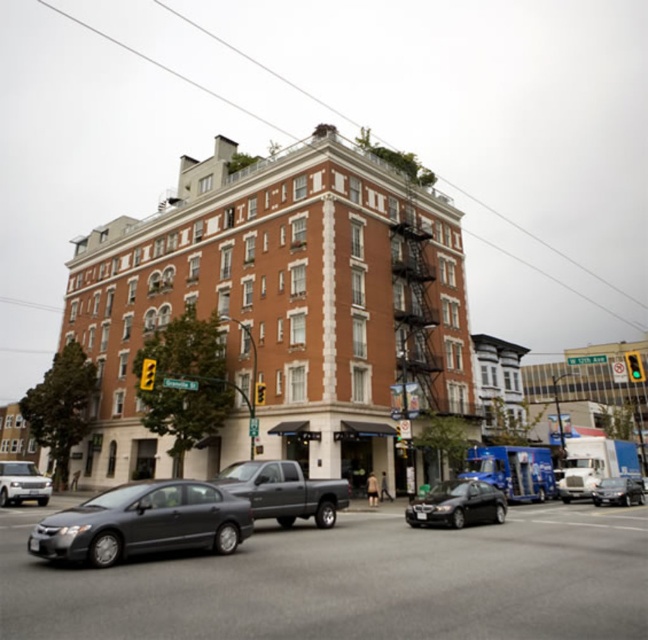
You are driving a metallic gray car at center and want to pass the shiny silver sedan at center ahead of you. Given that your car is 15 feet long, is there enough space to safely make this maneuver?

The distance between the metallic gray car at center and the shiny silver sedan at center is 88.78 feet. Since your car is only 15 feet long, there is sufficient space to safely pass the shiny silver sedan at center.

You are a pedestrian waiting at the crosswalk in front of the multi story brick building. You see a metallic gray car at center and a shiny silver sedan at center. Which car is blocking the other one from moving forward?

The metallic gray car at center is blocking the shiny silver sedan at center from moving forward since it is positioned in front of it.

You are a pedestrian waiting at the intersection. You see a metallic gray car at center and a shiny black sedan at center. Which vehicle will you need to wait for to pass before crossing safely?

The shiny black sedan at center is longer than the metallic gray car at center, so it will take more time to pass. You should wait until both vehicles have completely passed before crossing safely.